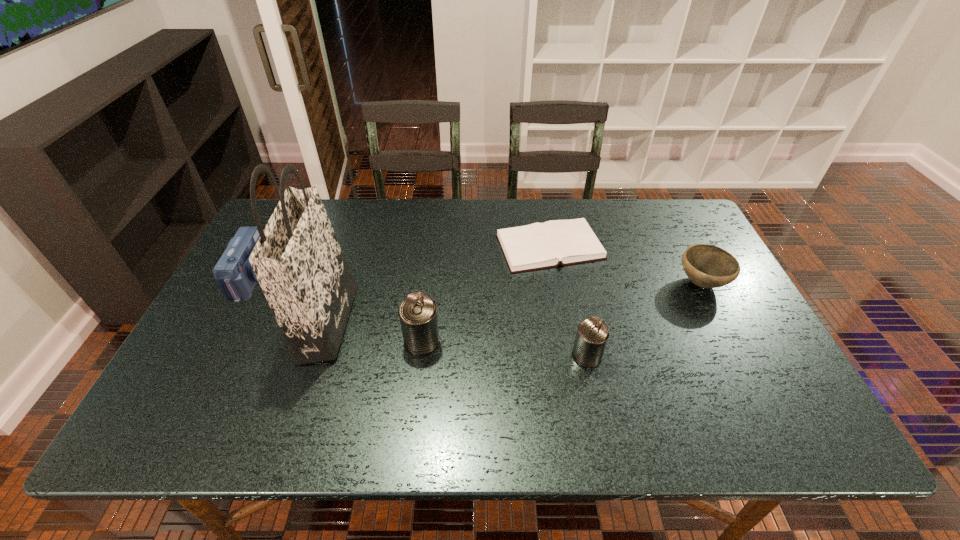
The width and height of the screenshot is (960, 540). Find the location of `vacant region located 0.050m on the right of the shorter can`. vacant region located 0.050m on the right of the shorter can is located at coordinates (622, 356).

Find the location of a particular element. This screenshot has height=540, width=960. vacant space positioned 0.360m on the lens of the camera is located at coordinates (393, 278).

Locate an element on the screen. free spot located on the front of the shortest object is located at coordinates (574, 386).

Identify the location of vacant region located on the back of the bowl. This screenshot has width=960, height=540. (684, 250).

I want to click on free space located on the front of the tallest object with the design, so click(415, 322).

Find the location of a particular element. The width and height of the screenshot is (960, 540). object located at the far edge is located at coordinates (536, 246).

The image size is (960, 540). Identify the location of object present at the near edge. (592, 334).

Locate an element on the screen. Image resolution: width=960 pixels, height=540 pixels. object that is at the left edge is located at coordinates (233, 272).

You are a GUI agent. You are given a task and a screenshot of the screen. Output one action in this format:
    pyautogui.click(x=<x>, y=<y>)
    Task: Click on the object present at the right edge
    
    Given the screenshot: What is the action you would take?
    pyautogui.click(x=708, y=266)

You are a GUI agent. You are given a task and a screenshot of the screen. Output one action in this format:
    pyautogui.click(x=<x>, y=<y>)
    Task: Click on the free space at the far edge
    
    Given the screenshot: What is the action you would take?
    pyautogui.click(x=409, y=199)